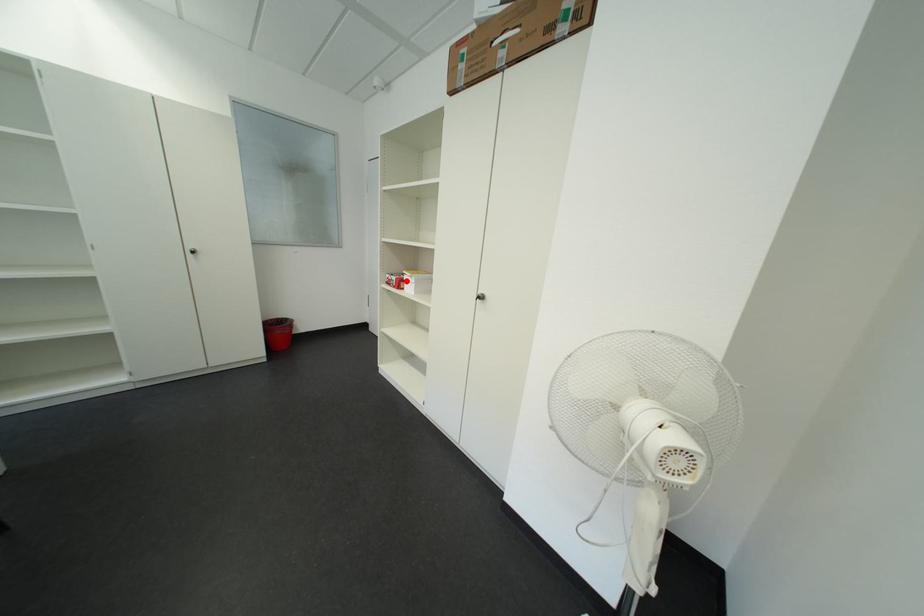
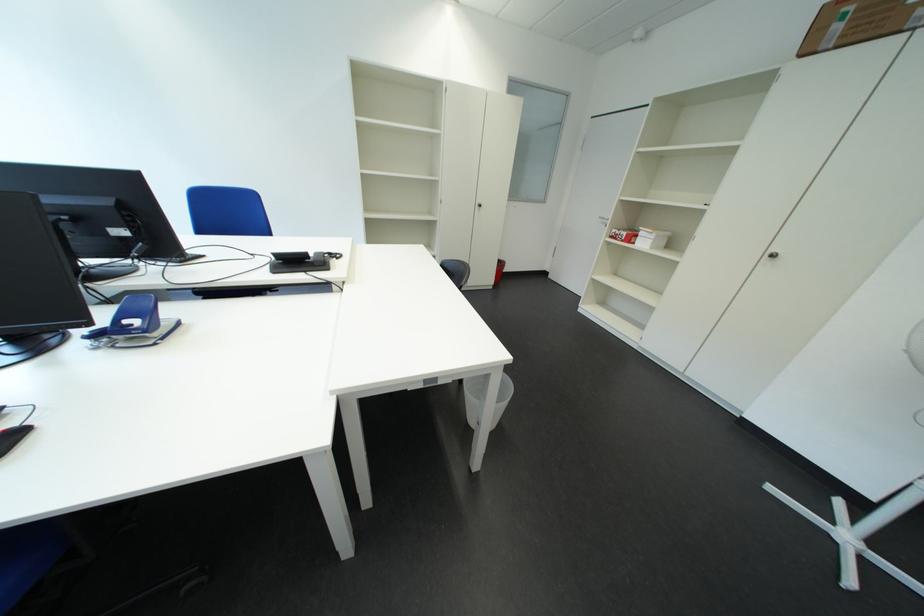
Question: I am providing you with two images of the same scene from different viewpoints. A red point is shown in image1. For the corresponding object point in image2, is it positioned nearer or farther from the camera?

Choices:
 (A) Nearer
 (B) Farther

Answer: (A)